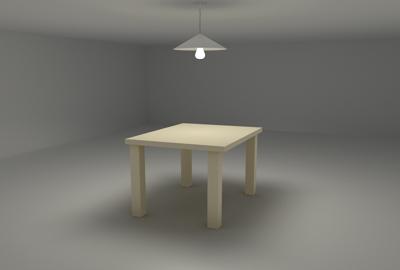
Identify the location of pale color floor. (338, 225).